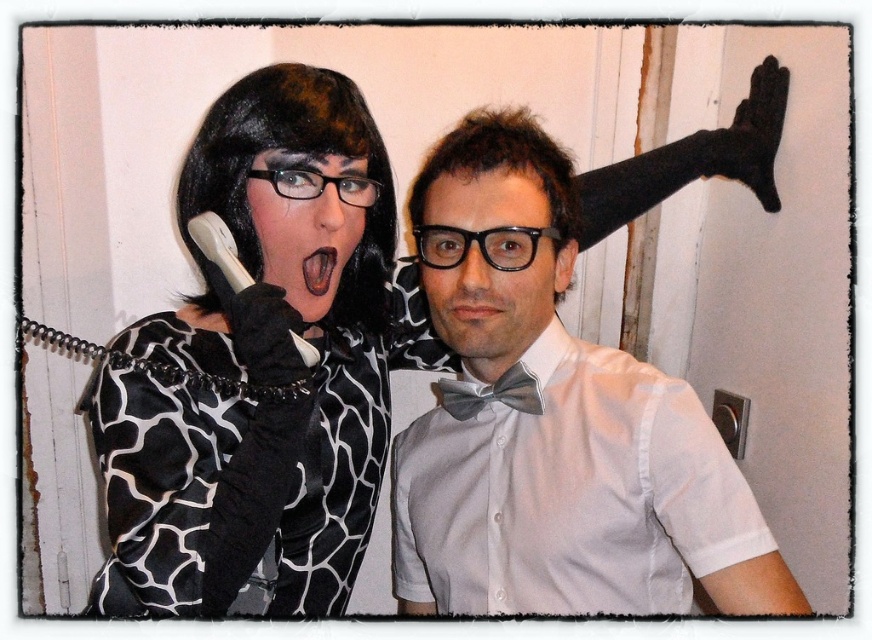
You are a photographer setting up for a group photo. You notice two bow ties in the scene. Which bow tie, the white matte bow tie at upper right or the gray satin bow tie at center, is positioned higher up in the image?

The white matte bow tie at upper right is positioned higher up in the image than the gray satin bow tie at center because it is taller.

You are a photographer adjusting the lighting for a portrait of the two people in the scene. You need to ensure both the matte black wig at upper left and the gray satin bow tie at center are well lit. Which object requires a wider light source to properly illuminate its entire width?

The matte black wig at upper left requires a wider light source because its width surpasses that of the gray satin bow tie at center, meaning it needs more coverage to be fully illuminated.